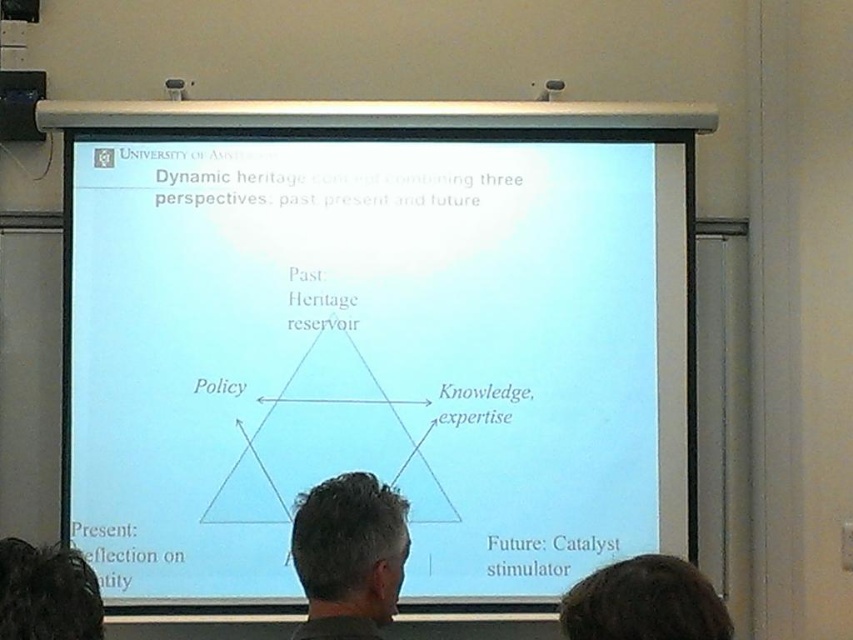
Question: Does gray hair at center have a larger size compared to dark brown hair at upper center?

Choices:
 (A) no
 (B) yes

Answer: (B)

Question: Does gray hair at center have a smaller size compared to dark brown hair at upper center?

Choices:
 (A) yes
 (B) no

Answer: (B)

Question: Which of the following is the closest to the observer?

Choices:
 (A) (674, 586)
 (B) (250, 458)
 (C) (373, 506)

Answer: (A)

Question: From the image, what is the correct spatial relationship of white paper at center in relation to gray hair at center?

Choices:
 (A) below
 (B) above

Answer: (B)

Question: Which of these objects is positioned closest to the gray hair at center?

Choices:
 (A) white paper at center
 (B) dark brown hair at upper center

Answer: (B)

Question: Which point is farther to the camera?

Choices:
 (A) dark brown hair at upper center
 (B) gray hair at center

Answer: (B)